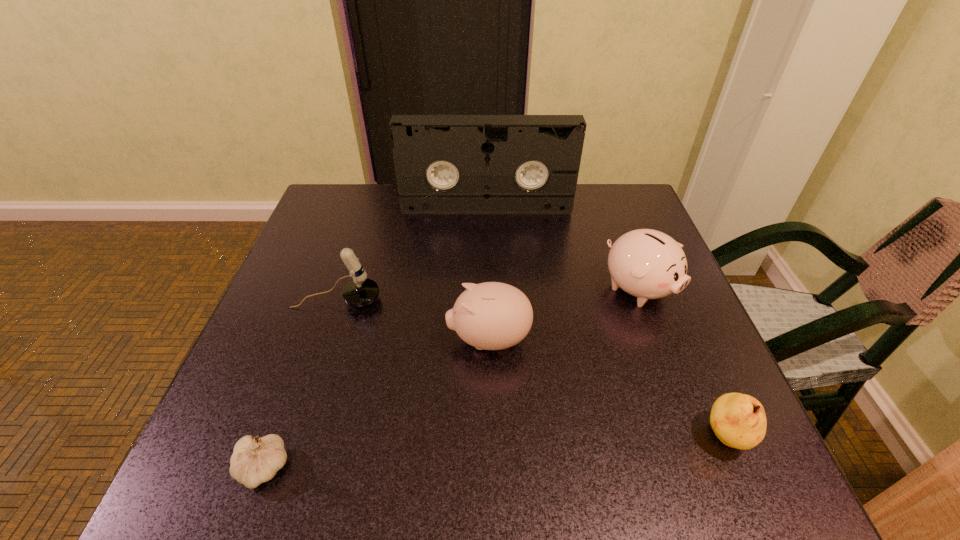
The image size is (960, 540). Identify the location of the tallest object. (445, 164).

Image resolution: width=960 pixels, height=540 pixels. Find the location of `the farthest object`. the farthest object is located at coordinates (445, 164).

Identify the location of the right piggy bank. The width and height of the screenshot is (960, 540). (648, 264).

Find the location of `microphone`. microphone is located at coordinates (361, 291).

The image size is (960, 540). What are the coordinates of `the left piggy bank` in the screenshot? It's located at pyautogui.click(x=489, y=316).

I want to click on pear, so click(x=739, y=421).

Locate an element on the screen. The width and height of the screenshot is (960, 540). garlic is located at coordinates (253, 462).

The height and width of the screenshot is (540, 960). I want to click on free space located 0.250m on the side of the videotape with visible spindles, so click(488, 277).

Image resolution: width=960 pixels, height=540 pixels. In order to click on free space located on the back of the right piggy bank in this screenshot , I will do `click(612, 220)`.

Identify the location of free space located 0.220m on the front of the microphone. (302, 406).